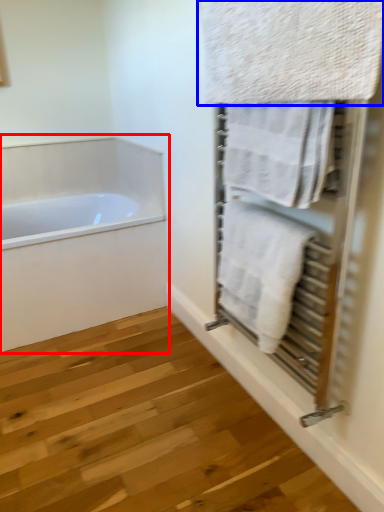
Question: Which object appears closest to the camera in this image, bathtub (highlighted by a red box) or towel (highlighted by a blue box)?

Choices:
 (A) bathtub
 (B) towel

Answer: (B)